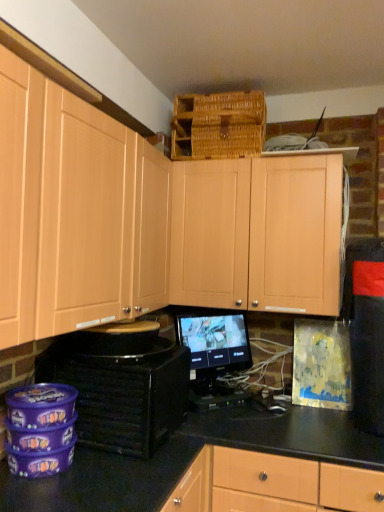
Question: Does light wood cabinet at upper center, the first cabinetry from the right, have a smaller size compared to black glossy counter top at center?

Choices:
 (A) yes
 (B) no

Answer: (B)

Question: From the image's perspective, would you say light wood cabinet at upper center, acting as the 2th cabinetry starting from the left, is shown under black glossy counter top at center?

Choices:
 (A) yes
 (B) no

Answer: (B)

Question: From the image's perspective, is light wood cabinet at upper center, the first cabinetry from the right, on top of black glossy counter top at center?

Choices:
 (A) no
 (B) yes

Answer: (B)

Question: Does light wood cabinet at upper center, the first cabinetry from the right, touch black glossy counter top at center?

Choices:
 (A) no
 (B) yes

Answer: (A)

Question: Considering the relative sizes of light wood cabinet at upper center, the first cabinetry from the right, and black glossy counter top at center in the image provided, is light wood cabinet at upper center, the first cabinetry from the right, shorter than black glossy counter top at center?

Choices:
 (A) no
 (B) yes

Answer: (A)

Question: Is light wood cabinet at upper center, acting as the 2th cabinetry starting from the left, at the left side of black glossy counter top at center?

Choices:
 (A) yes
 (B) no

Answer: (A)

Question: Considering the relative positions of matte wood cabinets at upper center, which ranks as the 1th cabinetry in left-to-right order, and light wood cabinet at upper center, the first cabinetry from the right, in the image provided, is matte wood cabinets at upper center, which ranks as the 1th cabinetry in left-to-right order, behind light wood cabinet at upper center, the first cabinetry from the right,?

Choices:
 (A) yes
 (B) no

Answer: (B)

Question: Can you confirm if matte wood cabinets at upper center, which ranks as the 1th cabinetry in left-to-right order, is bigger than light wood cabinet at upper center, acting as the 2th cabinetry starting from the left?

Choices:
 (A) yes
 (B) no

Answer: (A)

Question: Is matte wood cabinets at upper center, which ranks as the 1th cabinetry in left-to-right order, thinner than light wood cabinet at upper center, acting as the 2th cabinetry starting from the left?

Choices:
 (A) yes
 (B) no

Answer: (A)

Question: Considering the relative positions of matte wood cabinets at upper center, the second cabinetry in the right-to-left sequence, and light wood cabinet at upper center, the first cabinetry from the right, in the image provided, is matte wood cabinets at upper center, the second cabinetry in the right-to-left sequence, to the left of light wood cabinet at upper center, the first cabinetry from the right, from the viewer's perspective?

Choices:
 (A) no
 (B) yes

Answer: (B)

Question: From the image's perspective, is matte wood cabinets at upper center, which ranks as the 1th cabinetry in left-to-right order, beneath light wood cabinet at upper center, acting as the 2th cabinetry starting from the left?

Choices:
 (A) yes
 (B) no

Answer: (B)

Question: Does matte wood cabinets at upper center, the second cabinetry in the right-to-left sequence, come in front of light wood cabinet at upper center, the first cabinetry from the right?

Choices:
 (A) no
 (B) yes

Answer: (B)

Question: Can you confirm if matte wood cabinets at upper center, the second cabinetry in the right-to-left sequence, is shorter than black matte speaker at lower left?

Choices:
 (A) yes
 (B) no

Answer: (B)